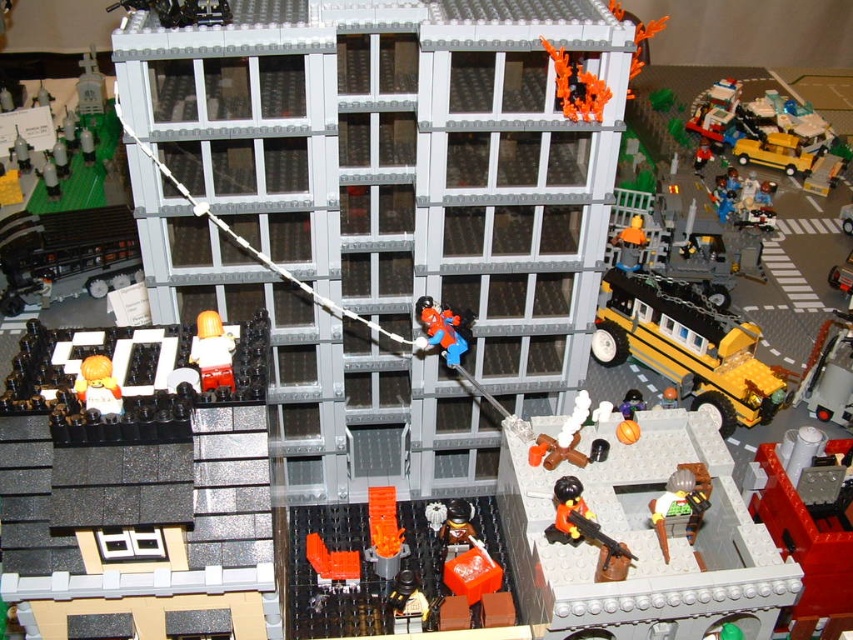
You are a delivery drone flying above the Lego city scene. You need to drop a package at the exact location of the black glossy minifigure at upper left. What are the coordinates where you should drop the package?

The coordinates for dropping the package should be at point (x=137, y=502), which is where the black glossy minifigure at upper left is located.